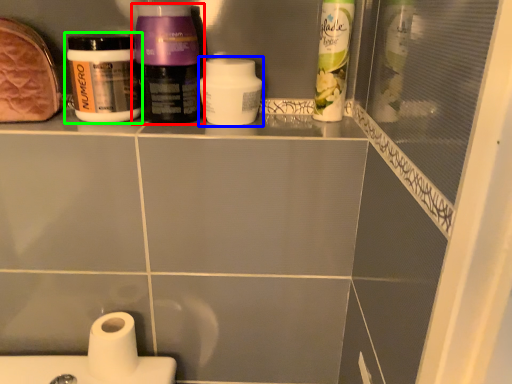
Question: Estimate the real-world distances between objects in this image. Which object is farther from bottle (highlighted by a red box), cleaning product (highlighted by a blue box) or bottle (highlighted by a green box)?

Choices:
 (A) cleaning product
 (B) bottle

Answer: (A)